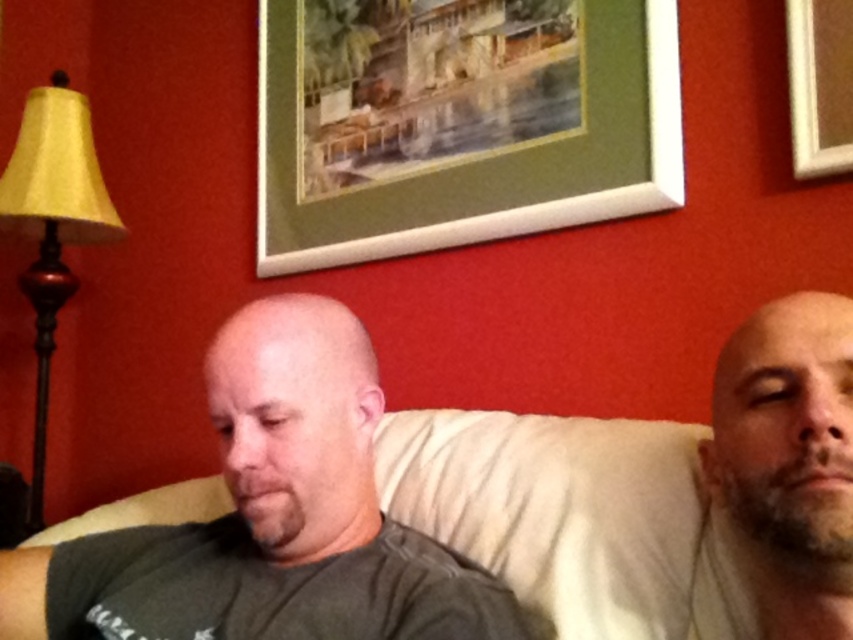
Who is taller, matte yellow fabric lampshade at left or wooden picture frame at upper right?

matte yellow fabric lampshade at left

Does matte yellow fabric lampshade at left appear over wooden picture frame at upper right?

No.

The width and height of the screenshot is (853, 640). In order to click on matte yellow fabric lampshade at left in this screenshot , I will do `click(49, 250)`.

Which is more to the left, green matte picture frame at upper center or beige fabric couch at center?

green matte picture frame at upper center is more to the left.

Is green matte picture frame at upper center smaller than beige fabric couch at center?

Actually, green matte picture frame at upper center might be larger than beige fabric couch at center.

Who is more distant from viewer, (x=492, y=221) or (x=625, y=438)?

The point (x=492, y=221) is more distant.

The image size is (853, 640). I want to click on green matte picture frame at upper center, so click(457, 122).

The height and width of the screenshot is (640, 853). What do you see at coordinates (457, 122) in the screenshot?
I see `green matte picture frame at upper center` at bounding box center [457, 122].

Does green matte picture frame at upper center appear under matte yellow fabric lampshade at left?

No.

Where is `green matte picture frame at upper center`? This screenshot has width=853, height=640. green matte picture frame at upper center is located at coordinates (457, 122).

Identify the location of green matte picture frame at upper center. (457, 122).